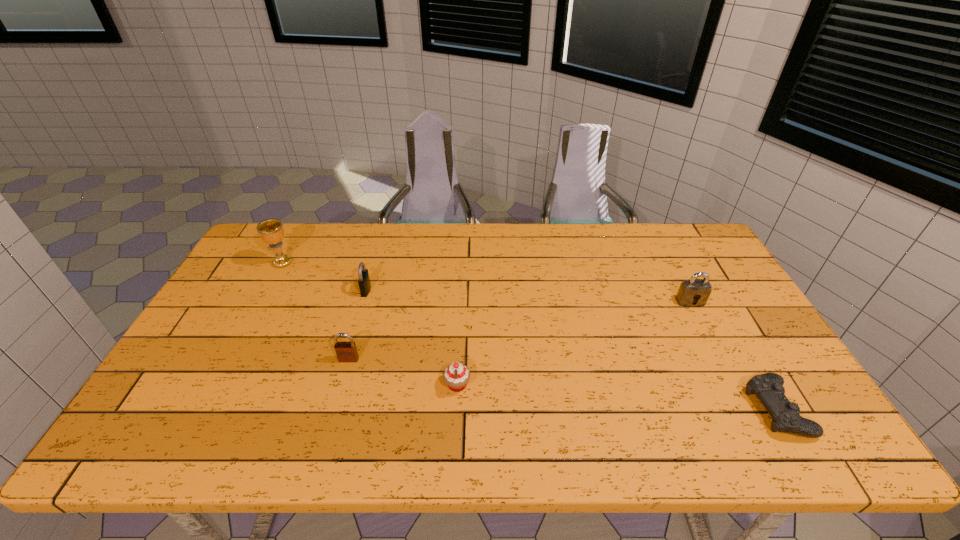
Where is `chalice`? chalice is located at coordinates (271, 231).

This screenshot has width=960, height=540. Find the location of `the leftmost object`. the leftmost object is located at coordinates (271, 231).

You are a GUI agent. You are given a task and a screenshot of the screen. Output one action in this format:
    pyautogui.click(x=<x>, y=<y>)
    Task: Click on the rightmost padlock
    The width and height of the screenshot is (960, 540).
    Given the screenshot: What is the action you would take?
    pyautogui.click(x=690, y=290)

Identify the location of the nearest padlock. This screenshot has height=540, width=960. (346, 351).

This screenshot has height=540, width=960. I want to click on cupcake, so click(x=456, y=375).

Identify the location of control. (768, 387).

Find the location of a particular element. This screenshot has height=540, width=960. vacant region located on the front of the farthest object is located at coordinates (262, 302).

Image resolution: width=960 pixels, height=540 pixels. In order to click on vacant area located at the front of the rightmost padlock near the keyhole in this screenshot , I will do click(x=743, y=404).

Locate an element on the screen. The height and width of the screenshot is (540, 960). free space located on the front-facing side of the third nearest object is located at coordinates (337, 402).

Locate an element on the screen. vacant region located on the left of the cupcake is located at coordinates (384, 385).